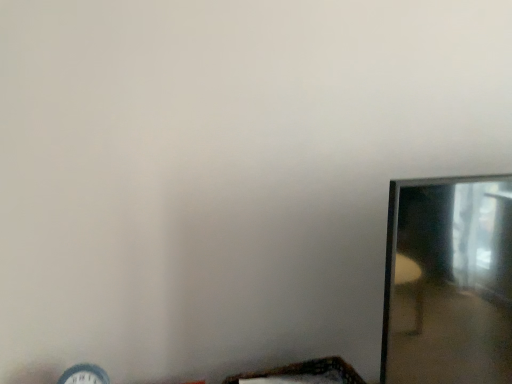
Question: From their relative heights in the image, would you say wooden woven basket at lower center is taller or shorter than clear glass mirror at right?

Choices:
 (A) short
 (B) tall

Answer: (A)

Question: Is wooden woven basket at lower center spatially inside clear glass mirror at right, or outside of it?

Choices:
 (A) outside
 (B) inside

Answer: (A)

Question: Estimate the real-world distances between objects in this image. Which object is closer to the wooden woven basket at lower center?

Choices:
 (A) matte white clock at lower left
 (B) clear glass mirror at right

Answer: (B)

Question: Estimate the real-world distances between objects in this image. Which object is farther from the clear glass mirror at right?

Choices:
 (A) matte white clock at lower left
 (B) wooden woven basket at lower center

Answer: (A)